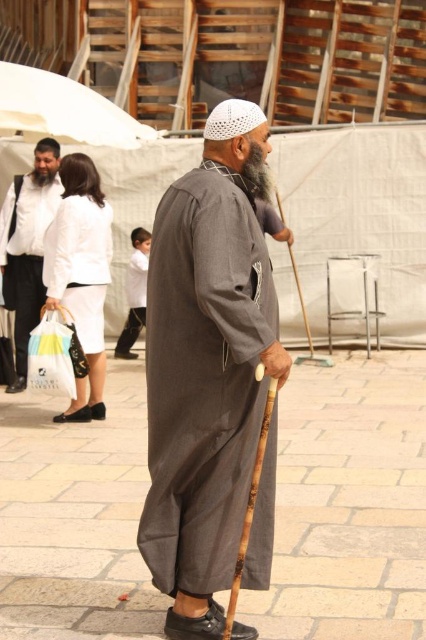
Is white matte jacket at upper left above white cotton dress at lower left?

Yes.

Does white matte jacket at upper left have a lesser height compared to white cotton dress at lower left?

In fact, white matte jacket at upper left may be taller than white cotton dress at lower left.

Between point (42, 179) and point (60, 259), which one is positioned in front?

Point (60, 259)

Locate an element on the screen. white matte jacket at upper left is located at coordinates (28, 246).

Does point (241, 182) come behind point (37, 184)?

No, (241, 182) is in front of (37, 184).

Is point (187, 276) positioned in front of point (40, 260)?

That is True.

Image resolution: width=426 pixels, height=640 pixels. Identify the location of gray fabric abaya at center. (206, 371).

The width and height of the screenshot is (426, 640). Identify the location of white cotton dress at lower left. (80, 264).

Between white cotton dress at lower left and gray fuzzy beard at center, which one has more height?

white cotton dress at lower left is taller.

Identify the location of white cotton dress at lower left. This screenshot has width=426, height=640. (80, 264).